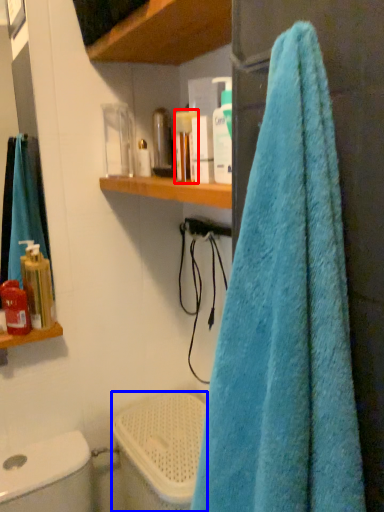
Question: Among these objects, which one is nearest to the camera, toiletry (highlighted by a red box) or toilet bowl (highlighted by a blue box)?

Choices:
 (A) toiletry
 (B) toilet bowl

Answer: (A)